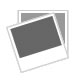
Find the location of `picture`. picture is located at coordinates (66, 47).